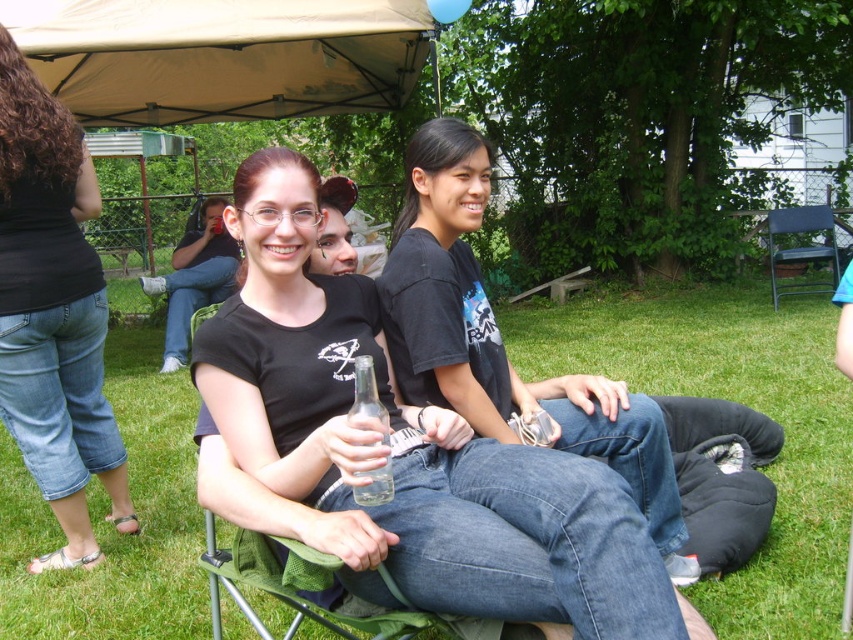
You are standing at the position of the woman with reddish brown hair and glasses. You want to walk to the point located at coordinates point (781, 288). Is the point at point (309, 246) in between your current position and your destination?

Yes, the point at point (309, 246) is in between your current position and the destination point (781, 288) because the point (309, 246) is in front of point (781, 288).